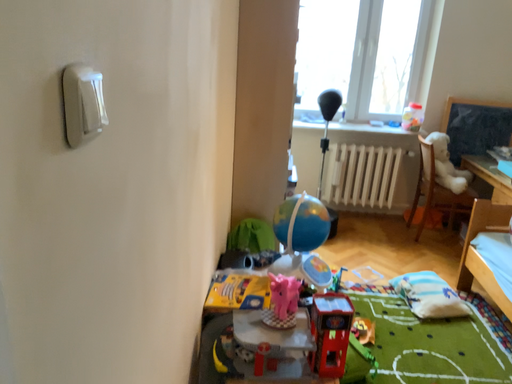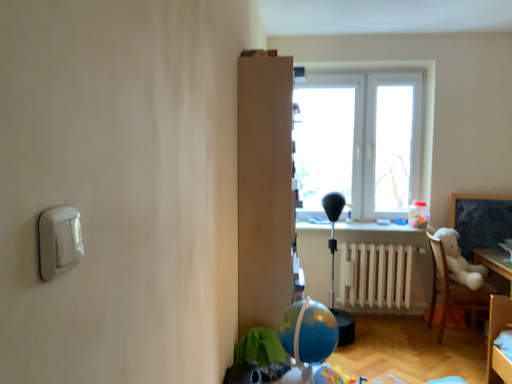
Question: Which way did the camera rotate in the video?

Choices:
 (A) rotated upward
 (B) rotated downward

Answer: (A)